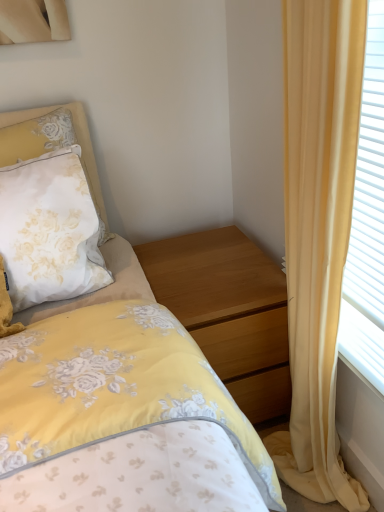
Question: Is the depth of wooden nightstand at center greater than that of white satin pillow at upper left?

Choices:
 (A) yes
 (B) no

Answer: (A)

Question: Is wooden nightstand at center far away from white satin pillow at upper left?

Choices:
 (A) no
 (B) yes

Answer: (A)

Question: Is wooden nightstand at center located outside white satin pillow at upper left?

Choices:
 (A) yes
 (B) no

Answer: (A)

Question: Does wooden nightstand at center come in front of white satin pillow at upper left?

Choices:
 (A) yes
 (B) no

Answer: (B)

Question: Does wooden nightstand at center have a greater height compared to white satin pillow at upper left?

Choices:
 (A) yes
 (B) no

Answer: (A)

Question: From a real-world perspective, is wooden nightstand at center positioned over white satin pillow at upper left based on gravity?

Choices:
 (A) no
 (B) yes

Answer: (A)

Question: Considering the relative sizes of wooden nightstand at center and yellow fabric curtain at right in the image provided, is wooden nightstand at center wider than yellow fabric curtain at right?

Choices:
 (A) no
 (B) yes

Answer: (B)

Question: Does wooden nightstand at center touch yellow fabric curtain at right?

Choices:
 (A) yes
 (B) no

Answer: (B)

Question: Is wooden nightstand at center not inside yellow fabric curtain at right?

Choices:
 (A) no
 (B) yes

Answer: (B)

Question: Could you tell me if wooden nightstand at center is facing yellow fabric curtain at right?

Choices:
 (A) yes
 (B) no

Answer: (B)

Question: Considering the relative sizes of wooden nightstand at center and yellow fabric curtain at right in the image provided, is wooden nightstand at center thinner than yellow fabric curtain at right?

Choices:
 (A) no
 (B) yes

Answer: (A)

Question: Is wooden nightstand at center positioned behind yellow fabric curtain at right?

Choices:
 (A) yes
 (B) no

Answer: (A)

Question: From the image's perspective, is yellow fabric curtain at right above wooden nightstand at center?

Choices:
 (A) no
 (B) yes

Answer: (B)